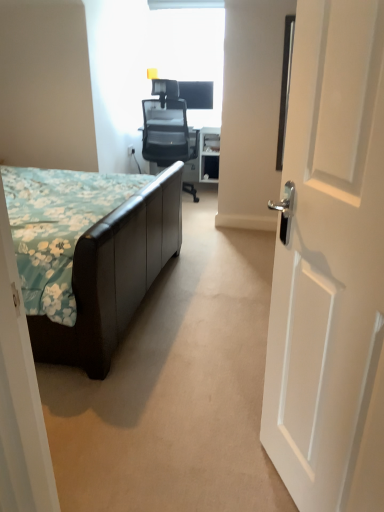
Question: Is black mesh office chair at center a part of white wooden door at right?

Choices:
 (A) yes
 (B) no

Answer: (B)

Question: From a real-world perspective, does white wooden door at right sit lower than black mesh office chair at center?

Choices:
 (A) no
 (B) yes

Answer: (A)

Question: From the image's perspective, is white wooden door at right above black mesh office chair at center?

Choices:
 (A) yes
 (B) no

Answer: (B)

Question: Is there a large distance between white wooden door at right and black mesh office chair at center?

Choices:
 (A) yes
 (B) no

Answer: (A)

Question: From the image's perspective, is white wooden door at right beneath black mesh office chair at center?

Choices:
 (A) yes
 (B) no

Answer: (A)

Question: Considering the positions of black mesh office chair at center and white wooden door at right in the image, is black mesh office chair at center bigger or smaller than white wooden door at right?

Choices:
 (A) small
 (B) big

Answer: (B)

Question: In terms of height, does black mesh office chair at center look taller or shorter compared to white wooden door at right?

Choices:
 (A) tall
 (B) short

Answer: (B)

Question: From a real-world perspective, is black mesh office chair at center positioned above or below white wooden door at right?

Choices:
 (A) above
 (B) below

Answer: (B)

Question: Considering the positions of point (147, 99) and point (289, 309), is point (147, 99) closer or farther from the camera than point (289, 309)?

Choices:
 (A) farther
 (B) closer

Answer: (A)

Question: Considering the positions of white wooden door at right and black mesh office chair at center in the image, is white wooden door at right bigger or smaller than black mesh office chair at center?

Choices:
 (A) big
 (B) small

Answer: (B)

Question: In the image, is white wooden door at right on the left side or the right side of black mesh office chair at center?

Choices:
 (A) left
 (B) right

Answer: (B)

Question: From the image's perspective, is white wooden door at right positioned above or below black mesh office chair at center?

Choices:
 (A) above
 (B) below

Answer: (B)

Question: Is white wooden door at right spatially inside black mesh office chair at center, or outside of it?

Choices:
 (A) outside
 (B) inside

Answer: (A)

Question: In the image, is white wooden door at right on the left side or the right side of brown leather bed at left?

Choices:
 (A) right
 (B) left

Answer: (A)

Question: Considering the positions of white wooden door at right and brown leather bed at left in the image, is white wooden door at right bigger or smaller than brown leather bed at left?

Choices:
 (A) big
 (B) small

Answer: (B)